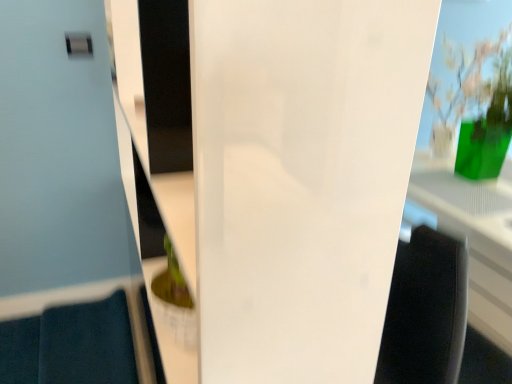
Question: Is transparent glass door at center oriented towards green glass vase at upper right?

Choices:
 (A) no
 (B) yes

Answer: (B)

Question: Can you confirm if transparent glass door at center is shorter than green glass vase at upper right?

Choices:
 (A) no
 (B) yes

Answer: (A)

Question: Is transparent glass door at center to the left of green glass vase at upper right from the viewer's perspective?

Choices:
 (A) yes
 (B) no

Answer: (A)

Question: Does transparent glass door at center have a greater width compared to green glass vase at upper right?

Choices:
 (A) no
 (B) yes

Answer: (A)

Question: Is green glass vase at upper right at the back of transparent glass door at center?

Choices:
 (A) no
 (B) yes

Answer: (A)

Question: Is transparent glass door at center bigger than green glass vase at upper right?

Choices:
 (A) no
 (B) yes

Answer: (B)

Question: Can you confirm if green glass vase at upper right is shorter than transparent glass door at center?

Choices:
 (A) no
 (B) yes

Answer: (B)

Question: Is green glass vase at upper right positioned beyond the bounds of transparent glass door at center?

Choices:
 (A) no
 (B) yes

Answer: (B)

Question: Can you confirm if green glass vase at upper right is wider than transparent glass door at center?

Choices:
 (A) yes
 (B) no

Answer: (A)

Question: Can you confirm if green glass vase at upper right is thinner than transparent glass door at center?

Choices:
 (A) no
 (B) yes

Answer: (A)

Question: Is transparent glass door at center at the back of green glass vase at upper right?

Choices:
 (A) no
 (B) yes

Answer: (B)

Question: Considering the relative positions of green glass vase at upper right and transparent glass door at center in the image provided, is green glass vase at upper right to the right of transparent glass door at center from the viewer's perspective?

Choices:
 (A) yes
 (B) no

Answer: (A)

Question: Is green glass vase at upper right to the left or to the right of transparent glass door at center in the image?

Choices:
 (A) right
 (B) left

Answer: (A)